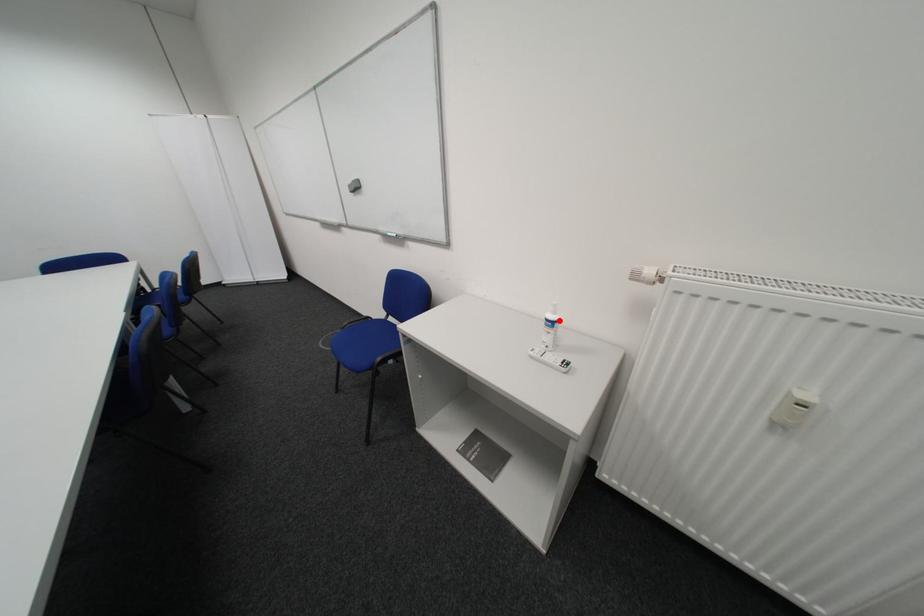
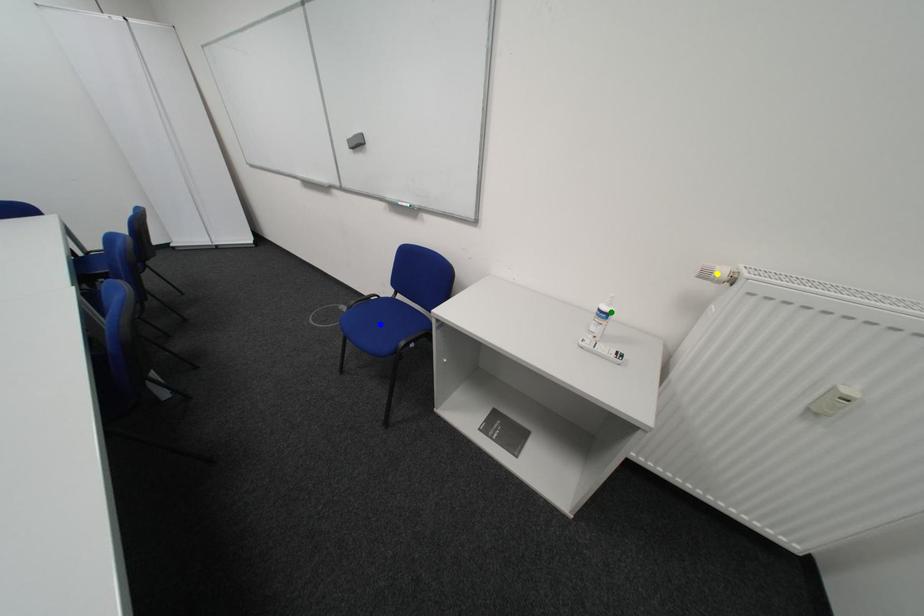
Question: I am providing you with two images of the same scene from different viewpoints. A red point is marked on the first image. You are given multiple points on the second image. Which mark in image 2 goes with the point in image 1?

Choices:
 (A) green point
 (B) blue point
 (C) yellow point

Answer: (A)